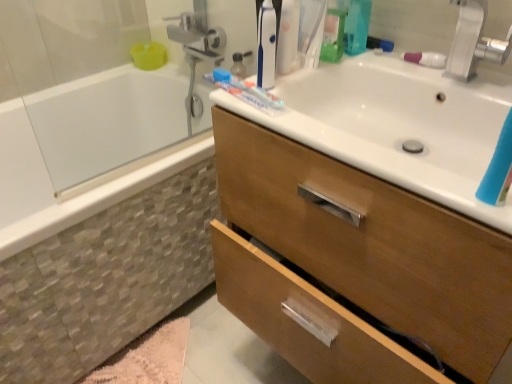
This screenshot has height=384, width=512. What are the coordinates of `free space in front of pink plastic toothbrush at upper right` in the screenshot? It's located at (455, 83).